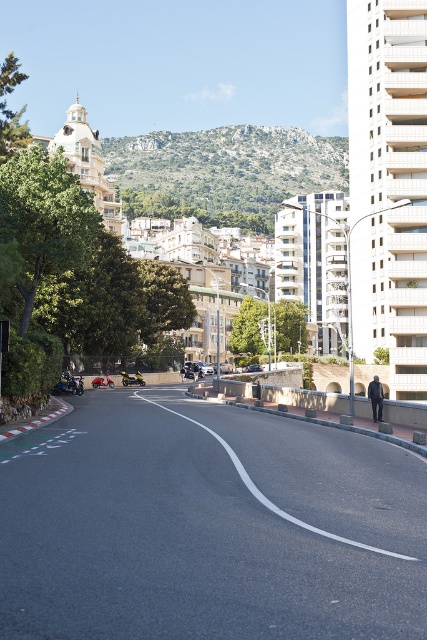
You are a delivery person trying to navigate through the area. You need to know which object is taller between the rocky brown hillside at upper center and the metallic red scooter at center. Can you tell me?

The rocky brown hillside at upper center is taller than the metallic red scooter at center according to the description.

You are a delivery person who needs to park your motorcycle near the shiny chrome motorcycle at lower left. The parking spot is at coordinates 0.602, 0.162. Can you safely park your motorcycle there?

The shiny chrome motorcycle at lower left is already parked at coordinates (69, 385), so the parking spot is occupied. Please choose another location.